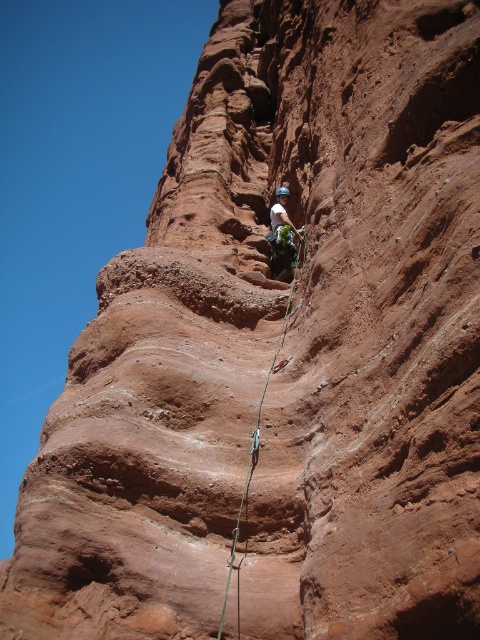
This screenshot has width=480, height=640. I want to click on green nylon rope at center, so click(x=261, y=406).

Who is higher up, green nylon rope at center or matte blue helmet at center?

Positioned higher is matte blue helmet at center.

Is point (243, 496) positioned behind point (291, 243)?

No, it is not.

Image resolution: width=480 pixels, height=640 pixels. Find the location of `green nylon rope at center`. green nylon rope at center is located at coordinates (261, 406).